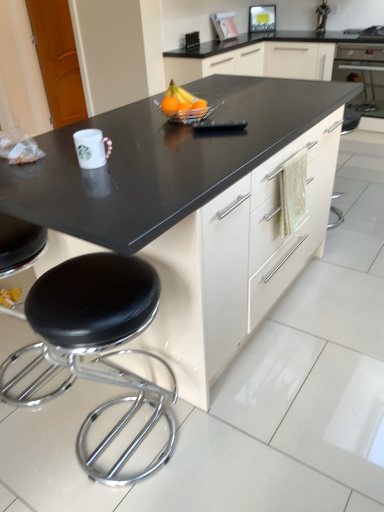
You are a GUI agent. You are given a task and a screenshot of the screen. Output one action in this format:
    pyautogui.click(x=<x>, y=<y>)
    Task: Click on the black glossy oven at upper right
    This screenshot has width=384, height=512.
    Given the screenshot: What is the action you would take?
    pyautogui.click(x=362, y=75)

The height and width of the screenshot is (512, 384). Describe the element at coordinates (362, 75) in the screenshot. I see `black glossy oven at upper right` at that location.

Describe the element at coordinates (170, 106) in the screenshot. The height and width of the screenshot is (512, 384). I see `orange matte at center, positioned as the 2th orange in right-to-left order` at that location.

Describe the element at coordinates (181, 101) in the screenshot. Image resolution: width=384 pixels, height=512 pixels. I see `glossy plastic bowl at center` at that location.

Find the location of a particular element. This screenshot has height=512, width=384. black leather stool at lower left is located at coordinates (94, 344).

Identify the location of black glossy oven at upper right. (362, 75).

From the image's perspective, which object appears higher, glossy plastic bowl at center or orange matte at center, which appears as the second orange when viewed from the left?

glossy plastic bowl at center is shown above in the image.

What are the coordinates of `fruit above the orange matte at center, which appears as the second orange when viewed from the left (from the image's perspective)` in the screenshot? It's located at (181, 101).

Can we say glossy plastic bowl at center lies outside orange matte at center, which appears as the second orange when viewed from the left?

Yes, glossy plastic bowl at center is outside of orange matte at center, which appears as the second orange when viewed from the left.

Is glossy plastic bowl at center in front of or behind orange matte at center, the first orange from the right, in the image?

glossy plastic bowl at center is behind orange matte at center, the first orange from the right.

Which of these two, orange matte at center, positioned as the first orange in left-to-right order, or orange matte at center, which appears as the second orange when viewed from the left, is smaller?

orange matte at center, which appears as the second orange when viewed from the left, is smaller.

From the image's perspective, which is above, orange matte at center, positioned as the first orange in left-to-right order, or orange matte at center, the first orange from the right?

orange matte at center, positioned as the first orange in left-to-right order.

Which object is more forward, orange matte at center, positioned as the first orange in left-to-right order, or orange matte at center, the first orange from the right?

orange matte at center, positioned as the first orange in left-to-right order, is in front.

Is point (164, 113) farther from camera compared to point (198, 101)?

That is False.

How many degrees apart are the facing directions of orange matte at center, the first orange from the right, and black leather stool at lower left?

89.7 degrees separate the facing orientations of orange matte at center, the first orange from the right, and black leather stool at lower left.

Who is bigger, orange matte at center, the first orange from the right, or black leather stool at lower left?

Bigger between the two is black leather stool at lower left.

Identify the location of the 1st orange above the black leather stool at lower left (from the image's perspective). This screenshot has width=384, height=512. (199, 108).

Considering the sizes of black glossy oven at upper right and orange matte at center, the first orange from the right, in the image, is black glossy oven at upper right bigger or smaller than orange matte at center, the first orange from the right,?

In the image, black glossy oven at upper right appears to be larger than orange matte at center, the first orange from the right.

Can you tell me how much black glossy oven at upper right and orange matte at center, which appears as the second orange when viewed from the left, differ in facing direction?

89.5 degrees separate the facing orientations of black glossy oven at upper right and orange matte at center, which appears as the second orange when viewed from the left.

Would you say black glossy oven at upper right is outside orange matte at center, the first orange from the right?

That's correct, black glossy oven at upper right is outside of orange matte at center, the first orange from the right.

Locate an element on the screen. The height and width of the screenshot is (512, 384). oven directly beneath the orange matte at center, which appears as the second orange when viewed from the left (from a real-world perspective) is located at coordinates (362, 75).

Can you confirm if black glossy oven at upper right is bigger than glossy plastic bowl at center?

Correct, black glossy oven at upper right is larger in size than glossy plastic bowl at center.

Between black glossy oven at upper right and glossy plastic bowl at center, which one appears on the right side from the viewer's perspective?

black glossy oven at upper right is more to the right.

Between point (370, 99) and point (167, 90), which one is positioned in front?

The point (167, 90) is in front.

From the image's perspective, which is below, black glossy oven at upper right or glossy plastic bowl at center?

glossy plastic bowl at center is shown below in the image.

In the image, is orange matte at center, the first orange from the right, on the left side or the right side of glossy plastic bowl at center?

orange matte at center, the first orange from the right, is positioned on glossy plastic bowl at center's right side.

Which is nearer, (197, 108) or (177, 105)?

Point (197, 108).

Considering the positions of objects orange matte at center, the first orange from the right, and glossy plastic bowl at center in the image provided, who is behind, orange matte at center, the first orange from the right, or glossy plastic bowl at center?

glossy plastic bowl at center is further from the camera.

Is orange matte at center, the first orange from the right, in contact with glossy plastic bowl at center?

Indeed, orange matte at center, the first orange from the right, and glossy plastic bowl at center are beside each other and touching.

Is orange matte at center, positioned as the first orange in left-to-right order, facing towards glossy plastic bowl at center?

No, orange matte at center, positioned as the first orange in left-to-right order, is not aimed at glossy plastic bowl at center.

Can you confirm if orange matte at center, positioned as the 2th orange in right-to-left order, is positioned to the right of glossy plastic bowl at center?

Incorrect, orange matte at center, positioned as the 2th orange in right-to-left order, is not on the right side of glossy plastic bowl at center.

Considering the positions of objects orange matte at center, positioned as the first orange in left-to-right order, and glossy plastic bowl at center in the image provided, who is behind, orange matte at center, positioned as the first orange in left-to-right order, or glossy plastic bowl at center?

glossy plastic bowl at center.

From a real-world perspective, between orange matte at center, positioned as the first orange in left-to-right order, and glossy plastic bowl at center, who is vertically lower?

orange matte at center, positioned as the first orange in left-to-right order.

Starting from the glossy plastic bowl at center, which orange is the 1st one in front? Please provide its 2D coordinates.

[(199, 108)]

Where is `orange that is above the orange matte at center, which appears as the second orange when viewed from the left (from the image's perspective)`? orange that is above the orange matte at center, which appears as the second orange when viewed from the left (from the image's perspective) is located at coordinates (170, 106).

Looking at the image, which one is located further to black leather stool at lower left, orange matte at center, which appears as the second orange when viewed from the left, or black glossy oven at upper right?

Based on the image, black glossy oven at upper right appears to be further to black leather stool at lower left.

Looking at the image, which one is located closer to orange matte at center, which appears as the second orange when viewed from the left, black leather stool at lower left or orange matte at center, positioned as the first orange in left-to-right order?

orange matte at center, positioned as the first orange in left-to-right order, lies closer to orange matte at center, which appears as the second orange when viewed from the left, than the other object.

From the image, which object appears to be nearer to black leather stool at lower left, glossy plastic bowl at center or orange matte at center, positioned as the first orange in left-to-right order?

glossy plastic bowl at center.

When comparing their distances from black leather stool at lower left, does glossy plastic bowl at center or black glossy oven at upper right seem further?

black glossy oven at upper right.

In the scene shown: Based on their spatial positions, is orange matte at center, the first orange from the right, or black glossy oven at upper right further from orange matte at center, positioned as the 2th orange in right-to-left order?

black glossy oven at upper right lies further to orange matte at center, positioned as the 2th orange in right-to-left order, than the other object.

Which object lies further to the anchor point orange matte at center, which appears as the second orange when viewed from the left, orange matte at center, positioned as the first orange in left-to-right order, or glossy plastic bowl at center?

The object further to orange matte at center, which appears as the second orange when viewed from the left, is orange matte at center, positioned as the first orange in left-to-right order.

From the image, which object appears to be farther from black leather stool at lower left, orange matte at center, the first orange from the right, or orange matte at center, positioned as the 2th orange in right-to-left order?

orange matte at center, the first orange from the right, is further to black leather stool at lower left.

Based on the photo, considering their positions, is black leather stool at lower left positioned further to orange matte at center, positioned as the first orange in left-to-right order, than orange matte at center, the first orange from the right?

black leather stool at lower left is further to orange matte at center, positioned as the first orange in left-to-right order.

Locate an element on the screen. Image resolution: width=384 pixels, height=512 pixels. fruit located between black leather stool at lower left and black glossy oven at upper right in the depth direction is located at coordinates (181, 101).

Identify the location of orange that lies between orange matte at center, positioned as the first orange in left-to-right order, and black leather stool at lower left from top to bottom. (199, 108).

Locate an element on the screen. orange between orange matte at center, positioned as the 2th orange in right-to-left order, and black glossy oven at upper right from front to back is located at coordinates (199, 108).

The width and height of the screenshot is (384, 512). In order to click on fruit between orange matte at center, positioned as the first orange in left-to-right order, and black glossy oven at upper right from front to back in this screenshot , I will do `click(181, 101)`.